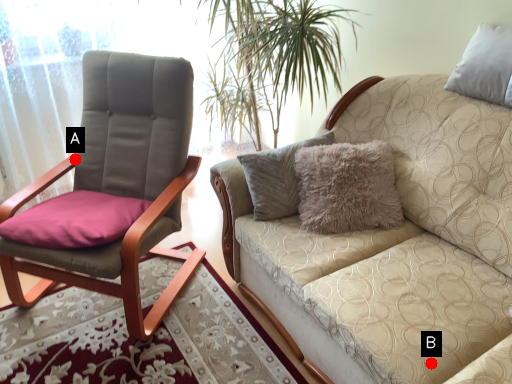
Question: Two points are circled on the image, labeled by A and B beside each circle. Which of the following is the closest to the observer?

Choices:
 (A) A is closer
 (B) B is closer

Answer: (B)